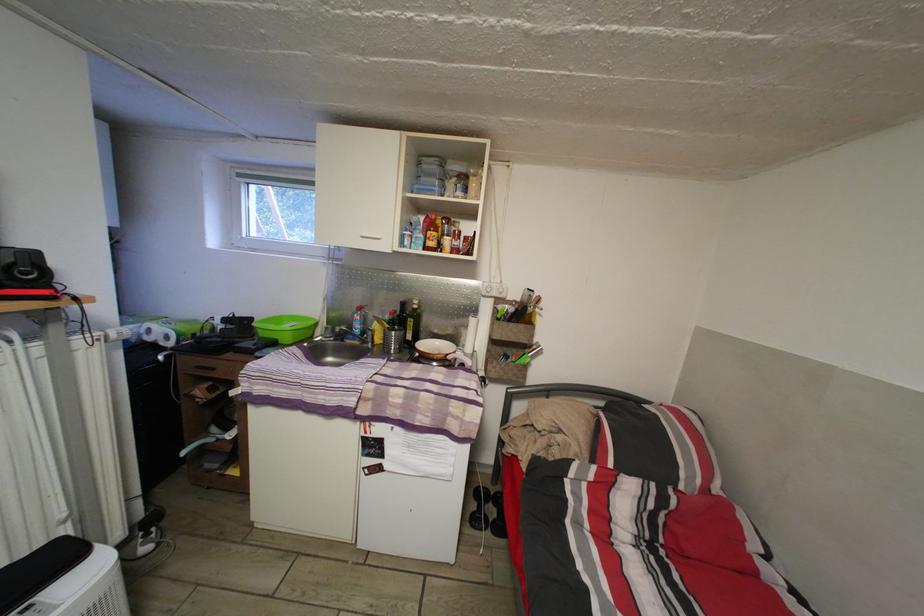
The image size is (924, 616). I want to click on window handle, so click(x=238, y=238).